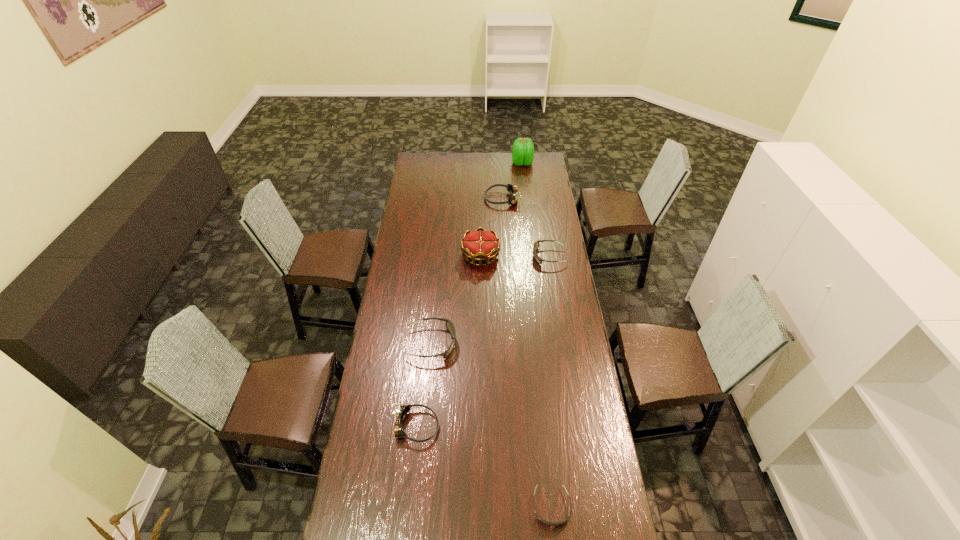
Locate an element on the screen. The width and height of the screenshot is (960, 540). the farthest object is located at coordinates (523, 150).

In order to click on the tallest object in this screenshot , I will do `click(523, 150)`.

At what (x,y) coordinates should I click in order to perform the action: click on crown. Please return your answer as a coordinate pair (x, y). The image size is (960, 540). Looking at the image, I should click on (477, 245).

Locate an element on the screen. The width and height of the screenshot is (960, 540). gold crown is located at coordinates (477, 245).

What are the coordinates of `the bigger bronze goggles` in the screenshot? It's located at (512, 189).

The width and height of the screenshot is (960, 540). In order to click on the farther bronze goggles in this screenshot , I will do `click(512, 189)`.

At what (x,y) coordinates should I click in order to perform the action: click on the second nearest black goggles. Please return your answer as a coordinate pair (x, y). Looking at the image, I should click on (449, 325).

The width and height of the screenshot is (960, 540). Identify the location of the third nearest goggles. (449, 325).

This screenshot has width=960, height=540. I want to click on the second nearest object, so click(x=402, y=411).

Locate an element on the screen. The width and height of the screenshot is (960, 540). the smaller bronze goggles is located at coordinates (402, 411).